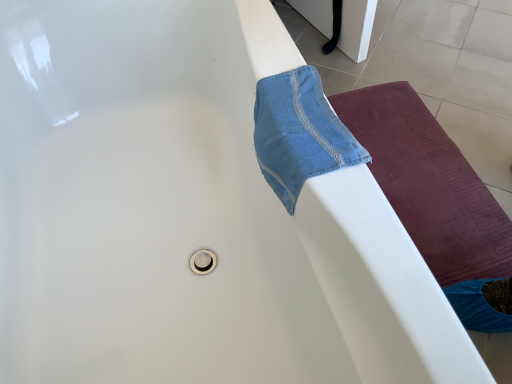
Describe the element at coordinates (429, 183) in the screenshot. I see `maroon textured yoga mat at right` at that location.

The width and height of the screenshot is (512, 384). What are the coordinates of `maroon textured yoga mat at right` in the screenshot? It's located at (429, 183).

The height and width of the screenshot is (384, 512). In order to click on blue cotton towel at upper right in this screenshot , I will do pyautogui.click(x=298, y=133).

Based on the photo, what is the approximate width of blue cotton towel at upper right?

The width of blue cotton towel at upper right is 4.68 inches.

The width and height of the screenshot is (512, 384). What do you see at coordinates (298, 133) in the screenshot? I see `blue cotton towel at upper right` at bounding box center [298, 133].

Locate an element on the screen. maroon textured yoga mat at right is located at coordinates (429, 183).

Would you say blue cotton towel at upper right is to the left or to the right of maroon textured yoga mat at right in the picture?

blue cotton towel at upper right is to the left of maroon textured yoga mat at right.

Which object is more forward, blue cotton towel at upper right or maroon textured yoga mat at right?

blue cotton towel at upper right is closer to the camera.

Is point (286, 149) less distant than point (410, 232)?

That is True.

Looking at this image, from the image's perspective, would you say blue cotton towel at upper right is shown under maroon textured yoga mat at right?

No.

Consider the image. From a real-world perspective, relative to maroon textured yoga mat at right, is blue cotton towel at upper right vertically above or below?

In terms of real-world spatial position, blue cotton towel at upper right is above maroon textured yoga mat at right.

Can you confirm if blue cotton towel at upper right is thinner than maroon textured yoga mat at right?

Correct, the width of blue cotton towel at upper right is less than that of maroon textured yoga mat at right.

Does blue cotton towel at upper right have a lesser height compared to maroon textured yoga mat at right?

Correct, blue cotton towel at upper right is not as tall as maroon textured yoga mat at right.

Is blue cotton towel at upper right bigger than maroon textured yoga mat at right?

No, blue cotton towel at upper right is not bigger than maroon textured yoga mat at right.

Would you say blue cotton towel at upper right is outside maroon textured yoga mat at right?

blue cotton towel at upper right lies outside maroon textured yoga mat at right's area.

Is blue cotton towel at upper right positioned far away from maroon textured yoga mat at right?

No, blue cotton towel at upper right is not far away from maroon textured yoga mat at right.

Is blue cotton towel at upper right facing towards maroon textured yoga mat at right?

No, blue cotton towel at upper right is not turned towards maroon textured yoga mat at right.

The height and width of the screenshot is (384, 512). I want to click on yoga mat that is behind the blue cotton towel at upper right, so click(x=429, y=183).

Considering the relative positions of maroon textured yoga mat at right and blue cotton towel at upper right in the image provided, is maroon textured yoga mat at right to the right of blue cotton towel at upper right from the viewer's perspective?

Yes.

Looking at this image, considering the positions of objects maroon textured yoga mat at right and blue cotton towel at upper right in the image provided, who is in front, maroon textured yoga mat at right or blue cotton towel at upper right?

Positioned in front is blue cotton towel at upper right.

Does point (444, 267) appear closer or farther from the camera than point (303, 103)?

Clearly, point (444, 267) is more distant from the camera than point (303, 103).

From the image's perspective, between maroon textured yoga mat at right and blue cotton towel at upper right, who is located below?

maroon textured yoga mat at right, from the image's perspective.

From a real-world perspective, which is physically above, maroon textured yoga mat at right or blue cotton towel at upper right?

blue cotton towel at upper right.

Considering the sizes of objects maroon textured yoga mat at right and blue cotton towel at upper right in the image provided, who is wider, maroon textured yoga mat at right or blue cotton towel at upper right?

maroon textured yoga mat at right is wider.

Between maroon textured yoga mat at right and blue cotton towel at upper right, which one has less height?

blue cotton towel at upper right is shorter.

Is maroon textured yoga mat at right bigger or smaller than blue cotton towel at upper right?

maroon textured yoga mat at right is bigger than blue cotton towel at upper right.

Can blue cotton towel at upper right be found inside maroon textured yoga mat at right?

No, blue cotton towel at upper right is not surrounded by maroon textured yoga mat at right.

Is maroon textured yoga mat at right directly adjacent to blue cotton towel at upper right?

maroon textured yoga mat at right and blue cotton towel at upper right are clearly separated.

From the picture: Is maroon textured yoga mat at right aimed at blue cotton towel at upper right?

No.

You are a GUI agent. You are given a task and a screenshot of the screen. Output one action in this format:
    pyautogui.click(x=<x>, y=<y>)
    Task: Click on the beach towel that appears above the maroon textured yoga mat at right (from a real-world perspective)
    Image resolution: width=512 pixels, height=384 pixels.
    Given the screenshot: What is the action you would take?
    pyautogui.click(x=298, y=133)

You are a GUI agent. You are given a task and a screenshot of the screen. Output one action in this format:
    pyautogui.click(x=<x>, y=<y>)
    Task: Click on the beach towel positioned vertically above the maroon textured yoga mat at right (from a real-world perspective)
    The width and height of the screenshot is (512, 384).
    Given the screenshot: What is the action you would take?
    pyautogui.click(x=298, y=133)

Where is `beach towel on the left of maroon textured yoga mat at right`? The image size is (512, 384). beach towel on the left of maroon textured yoga mat at right is located at coordinates (298, 133).